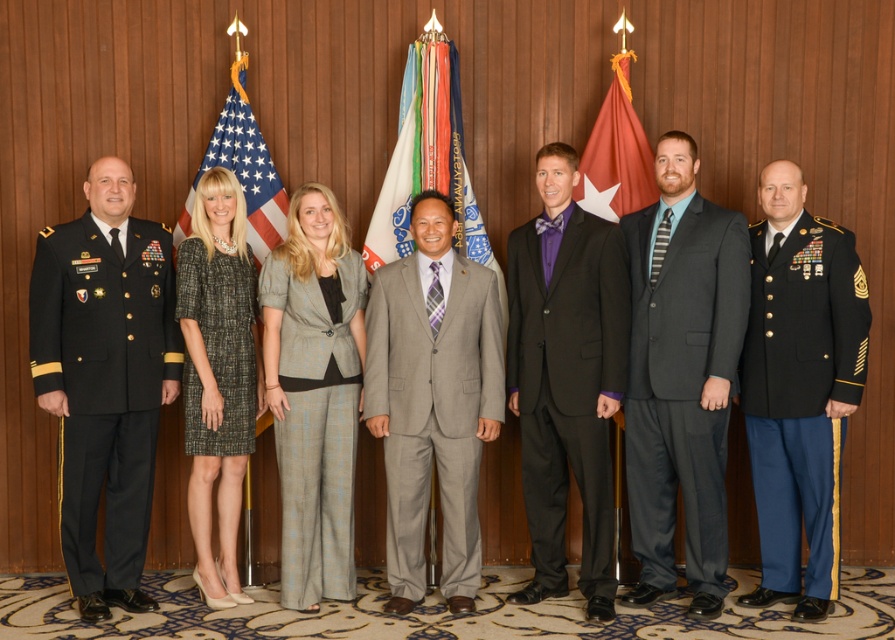
Question: Which point appears farthest from the camera in this image?

Choices:
 (A) (586, 560)
 (B) (761, 228)

Answer: (B)

Question: Is green tweed dress at center closer to camera compared to red fabric flag at center?

Choices:
 (A) no
 (B) yes

Answer: (B)

Question: Does gray tweed suit at center appear on the left side of red fabric flag at center?

Choices:
 (A) no
 (B) yes

Answer: (B)

Question: Can you confirm if dark gray suit at center is positioned below black wool suit at center?

Choices:
 (A) yes
 (B) no

Answer: (B)

Question: Estimate the real-world distances between objects in this image. Which object is farther from the red fabric flag at center?

Choices:
 (A) american flag at center
 (B) black military uniform at left
 (C) green tweed dress at center

Answer: (B)

Question: Based on their relative distances, which object is farther from the american flag at center?

Choices:
 (A) red fabric flag at center
 (B) dark blue wool military uniform at right
 (C) silky fabric flag at center
 (D) black wool suit at center

Answer: (B)